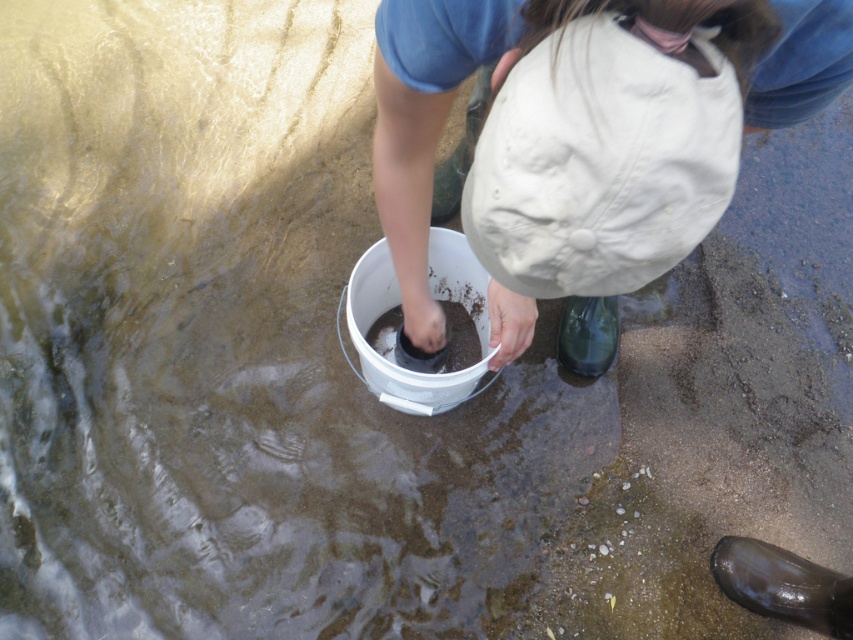
You are a researcher analyzing the scene. The coordinates of the white matte hat at center are given as point (425, 122). If the image has a coordinate system where the bottom left corner is the origin, what direction would the white matte hat at center be located relative to the bottom left corner?

The white matte hat at center is located at coordinates point (425, 122). In a coordinate system where the bottom left corner is the origin, the x and y values increase to the right and upwards respectively. Therefore, the white matte hat at center is positioned to the right and above the bottom left corner.

You are a researcher who needs to place a transparent plastic bottle at lower right into a storage container. However, there is a white matte hat at center in the way. Can you move the hat to access the bottle?

The white matte hat at center is positioned over the transparent plastic bottle at lower right, so you need to move the hat first to access the bottle.